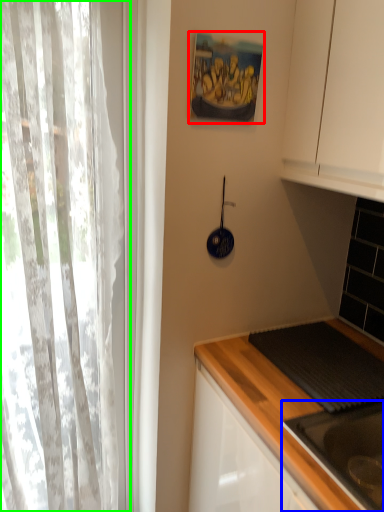
Question: Which object is the farthest from picture frame (highlighted by a red box)? Choose among these: sink (highlighted by a blue box) or curtain (highlighted by a green box).

Choices:
 (A) sink
 (B) curtain

Answer: (A)